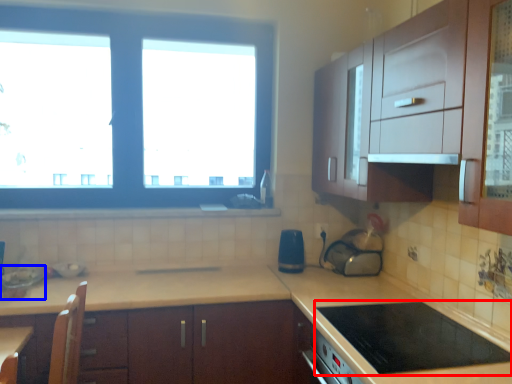
Question: Which of the following is the farthest to the observer, gas stove (highlighted by a red box) or appliance (highlighted by a blue box)?

Choices:
 (A) gas stove
 (B) appliance

Answer: (B)